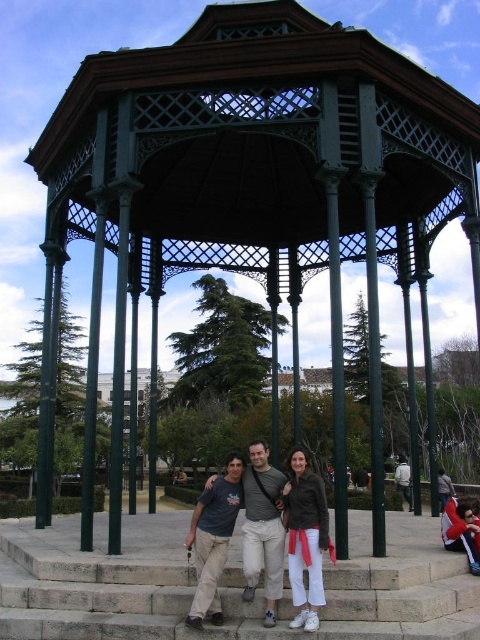
You are standing at the gazebo and want to walk towards the point labeled as point [331,632]. Which direction should you walk relative to the point labeled as point [228,477]?

You should walk towards the point labeled as point [331,632], which is in front of the point labeled as point [228,477].

You are standing at the gazebo and want to take a photo of two points marked in the image. The first point is at coordinate point (140, 579) and the second is at point (294, 570). Which point is closer to the gazebo?

Point (140, 579) is behind point (294, 570), so the second point at (294, 570) is closer to the gazebo.